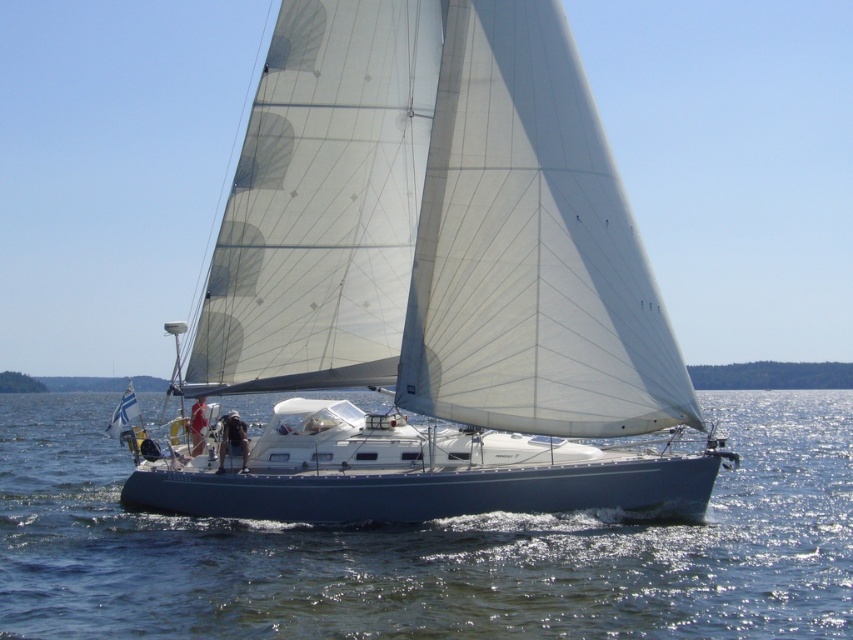
Question: Is white matte sailboat at center below clear blue water at center?

Choices:
 (A) yes
 (B) no

Answer: (B)

Question: Is white matte sailboat at center above clear blue water at center?

Choices:
 (A) yes
 (B) no

Answer: (A)

Question: Among these points, which one is farthest from the camera?

Choices:
 (A) (368, 620)
 (B) (657, 492)

Answer: (B)

Question: Is white matte sailboat at center bigger than clear blue water at center?

Choices:
 (A) yes
 (B) no

Answer: (B)